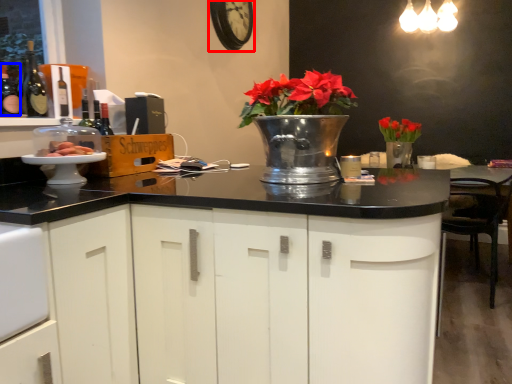
Question: Among these objects, which one is farthest to the camera, clock (highlighted by a red box) or bottle (highlighted by a blue box)?

Choices:
 (A) clock
 (B) bottle

Answer: (A)